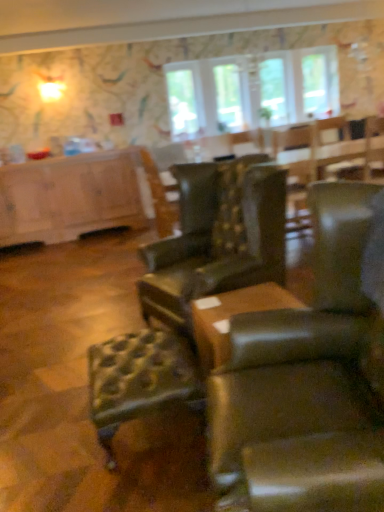
This screenshot has width=384, height=512. Find the location of `free location above leather tufted bar stool at center (from a real-world perspective)`. free location above leather tufted bar stool at center (from a real-world perspective) is located at coordinates (135, 361).